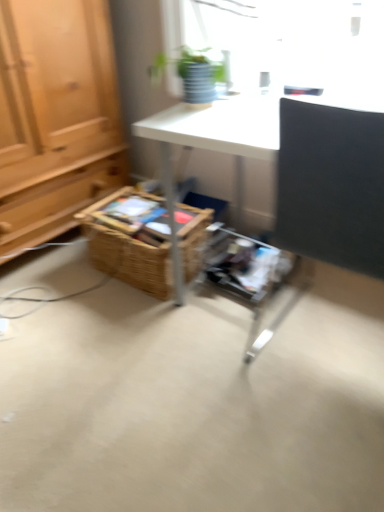
Question: Is green matte plant at upper center situated inside matte black desk at right or outside?

Choices:
 (A) inside
 (B) outside

Answer: (B)

Question: Considering the positions of green matte plant at upper center and matte black desk at right in the image, is green matte plant at upper center bigger or smaller than matte black desk at right?

Choices:
 (A) big
 (B) small

Answer: (B)

Question: Estimate the real-world distances between objects in this image. Which object is farther from the green matte plant at upper center?

Choices:
 (A) woven brown basket at center
 (B) matte black desk at right

Answer: (A)

Question: Estimate the real-world distances between objects in this image. Which object is farther from the matte black desk at right?

Choices:
 (A) green matte plant at upper center
 (B) woven brown basket at center

Answer: (B)